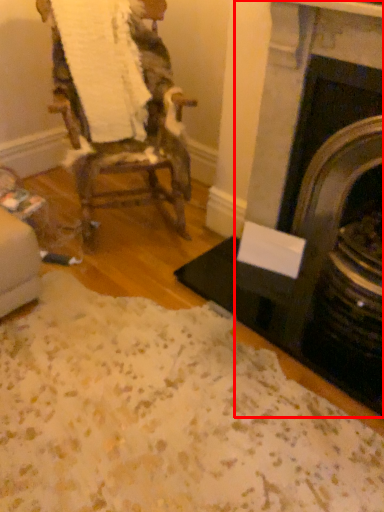
Question: From the image's perspective, what is the correct spatial relationship of fireplace (annotated by the red box) in relation to chair?

Choices:
 (A) above
 (B) below

Answer: (B)